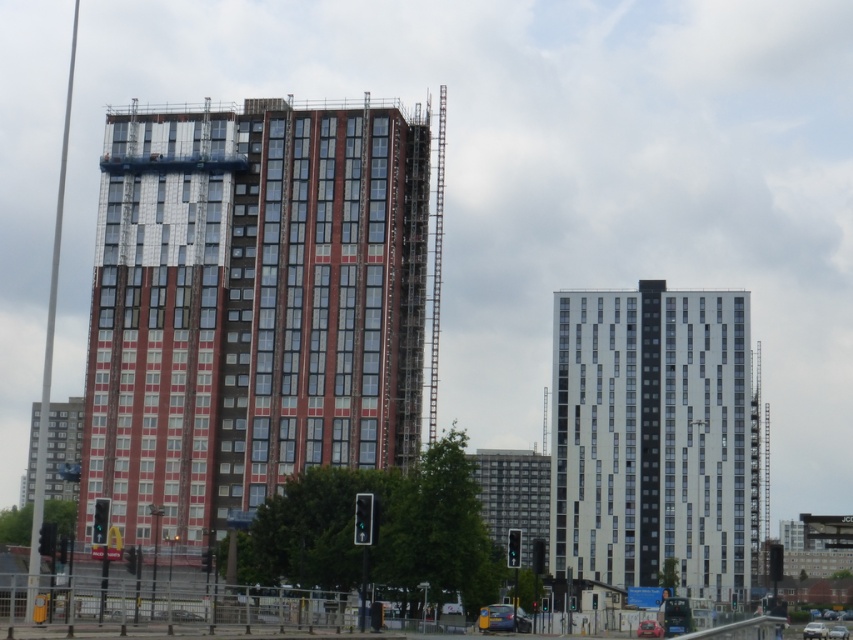
Question: Which object is closer to the camera taking this photo?

Choices:
 (A) red brick building at center
 (B) white glass building at center

Answer: (A)

Question: Is red brick building at center positioned before white glass building at center?

Choices:
 (A) yes
 (B) no

Answer: (A)

Question: Does red brick building at center appear over white glass building at center?

Choices:
 (A) yes
 (B) no

Answer: (A)

Question: Which of the following is the closest to the observer?

Choices:
 (A) (218, 170)
 (B) (679, 337)

Answer: (A)

Question: Observing the image, what is the correct spatial positioning of red brick building at center in reference to white glass building at center?

Choices:
 (A) left
 (B) right

Answer: (A)

Question: Which of the following is the farthest from the observer?

Choices:
 (A) red brick building at center
 (B) white glass building at center

Answer: (B)